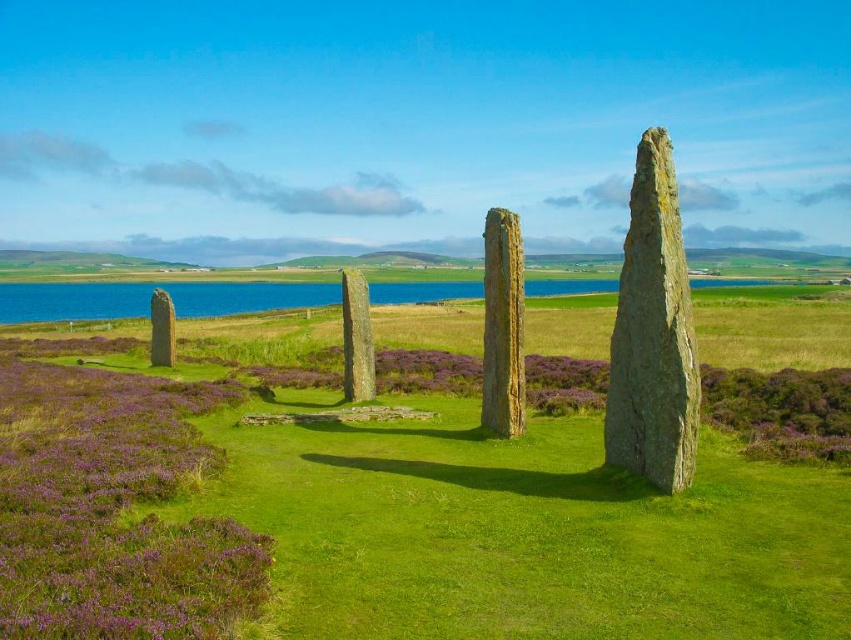
You are a landscape photographer planning to capture the smooth stone monolith at center and the rusty stone pillar at center in a single frame. Which of these two objects should you focus on to ensure the larger one is prominently featured?

The smooth stone monolith at center is larger in size than the rusty stone pillar at center, so focusing on the smooth stone monolith at center will ensure the larger object is prominently featured in your photograph.

You are a landscape architect planning to install a new pathway between the green grassy at center and the rusty stone pillar at center. Which area should the pathway be placed closer to if you want it to be wider?

The pathway should be placed closer to the green grassy at center since its width surpasses that of the rusty stone pillar at center.